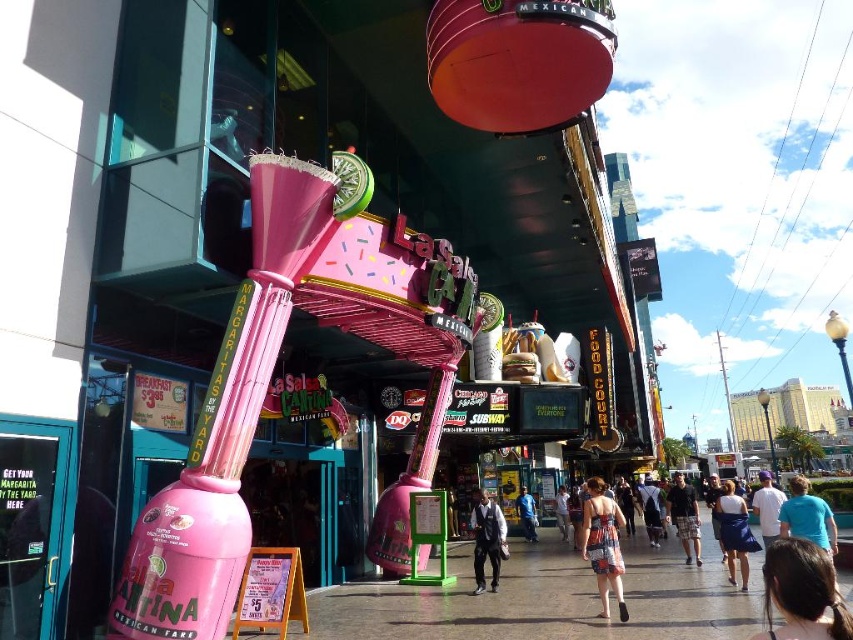
Question: Is smooth concrete sidewalk at center bigger than dark brown hair at lower right?

Choices:
 (A) no
 (B) yes

Answer: (B)

Question: Is denim jacket at center to the right of blue denim jeans at center from the viewer's perspective?

Choices:
 (A) yes
 (B) no

Answer: (A)

Question: Which point is closer to the camera?

Choices:
 (A) denim shorts at center
 (B) blue cotton shirt at center
 (C) smooth concrete sidewalk at center

Answer: (B)

Question: Which of the following is the farthest from the observer?

Choices:
 (A) coord(560,508)
 (B) coord(590,556)
 (C) coord(804,544)

Answer: (A)

Question: Which of the following is the farthest from the observer?

Choices:
 (A) denim shorts at center
 (B) blue cotton shirt at center

Answer: (A)

Question: Is blue cotton shirt at center to the left of black cotton t-shirt at center from the viewer's perspective?

Choices:
 (A) no
 (B) yes

Answer: (A)